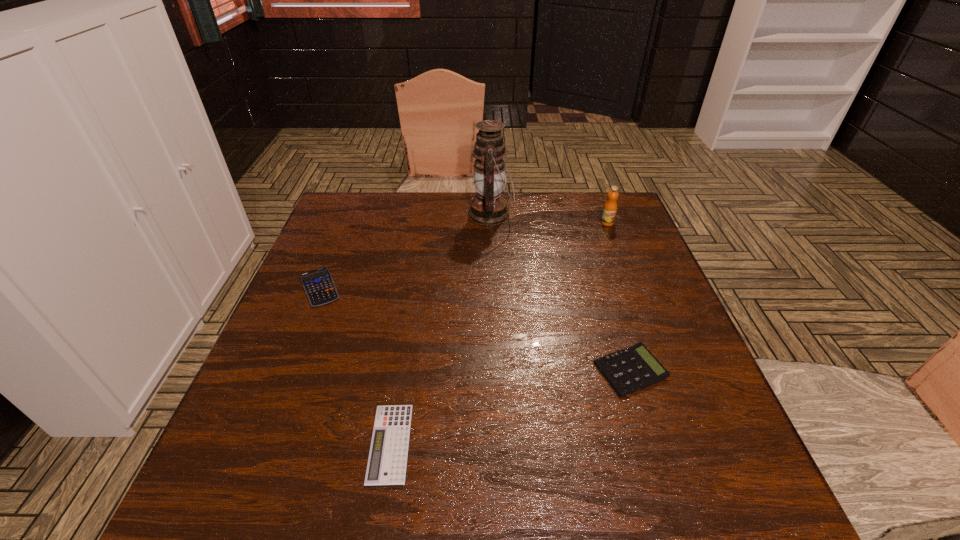
I want to click on vacant space in between the third object from left to right and the second object from left to right, so click(441, 329).

Where is `vacant space that is in between the orange juice and the lantern`? Image resolution: width=960 pixels, height=540 pixels. vacant space that is in between the orange juice and the lantern is located at coordinates (549, 219).

At what (x,y) coordinates should I click in order to perform the action: click on free area in between the nearest calculator and the second tallest object. Please return your answer as a coordinate pair (x, y). Image resolution: width=960 pixels, height=540 pixels. Looking at the image, I should click on (498, 333).

The width and height of the screenshot is (960, 540). I want to click on empty space that is in between the second farthest calculator and the leftmost calculator, so click(x=475, y=329).

Where is `empty location between the third nearest object and the fourth object from right to left`? Image resolution: width=960 pixels, height=540 pixels. empty location between the third nearest object and the fourth object from right to left is located at coordinates (355, 366).

Locate an element on the screen. The height and width of the screenshot is (540, 960). free spot between the rightmost calculator and the orange juice is located at coordinates coord(618,296).

Identify the location of object that can be found as the fourth closest to the orange juice. (387, 460).

Identify which object is located as the nearest to the nearest object. Please provide its 2D coordinates. Your answer should be formatted as a tuple, i.e. [(x, y)], where the tuple contains the x and y coordinates of a point satisfying the conditions above.

[(318, 284)]

The height and width of the screenshot is (540, 960). I want to click on calculator that stands as the closest to the second shortest calculator, so click(x=387, y=460).

Where is `calculator object that ranks as the third closest to the lantern`? This screenshot has height=540, width=960. calculator object that ranks as the third closest to the lantern is located at coordinates (387, 460).